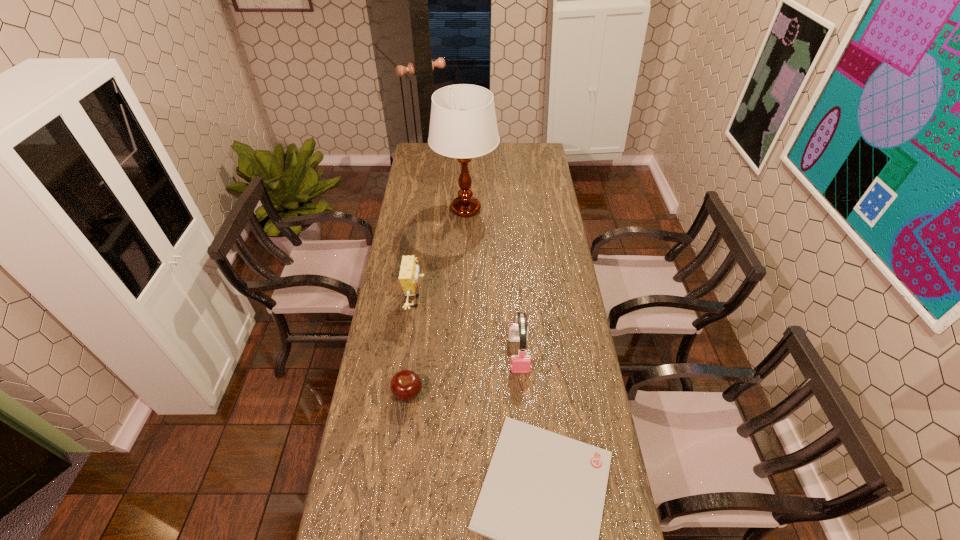
Where is `table lamp that is at the left edge`? The height and width of the screenshot is (540, 960). table lamp that is at the left edge is located at coordinates pos(463,125).

This screenshot has width=960, height=540. I want to click on sponge at the left edge, so click(x=408, y=275).

Where is `apple at the left edge`? apple at the left edge is located at coordinates (406, 385).

Find the location of a particular element. Image resolution: width=960 pixels, height=540 pixels. free space at the far edge of the desktop is located at coordinates (510, 161).

Identify the location of free space at the left edge. (385, 289).

The height and width of the screenshot is (540, 960). I want to click on vacant region at the right edge, so click(529, 194).

Where is `free spot at the far left corner of the desktop`? This screenshot has height=540, width=960. free spot at the far left corner of the desktop is located at coordinates (419, 143).

Where is `empty space that is in between the fourth farthest object and the third farthest object`? The height and width of the screenshot is (540, 960). empty space that is in between the fourth farthest object and the third farthest object is located at coordinates [x=464, y=374].

Find the location of a particular element. This screenshot has height=540, width=960. free space between the second nearest object and the fourth nearest object is located at coordinates (413, 347).

Where is `free spot between the apple and the sponge`? free spot between the apple and the sponge is located at coordinates (413, 347).